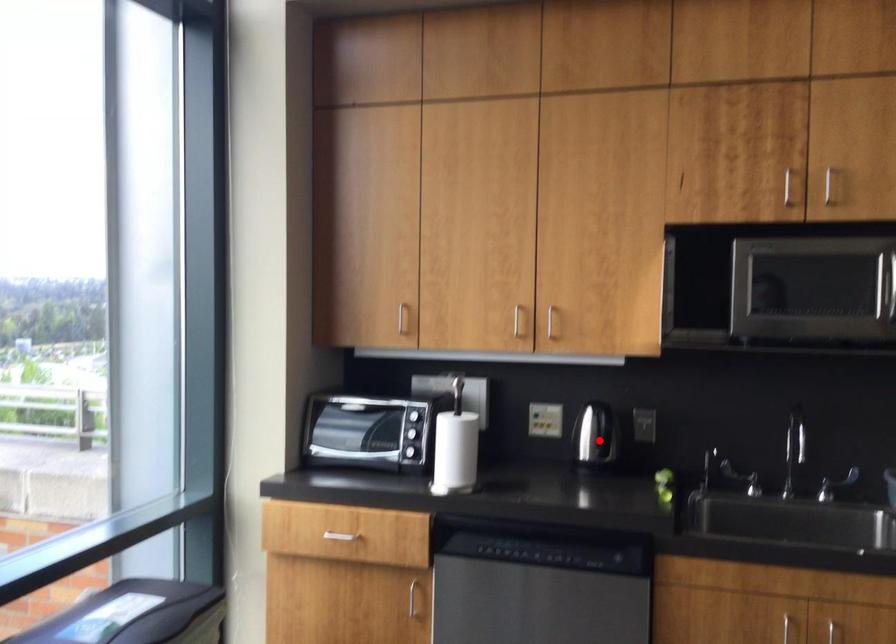
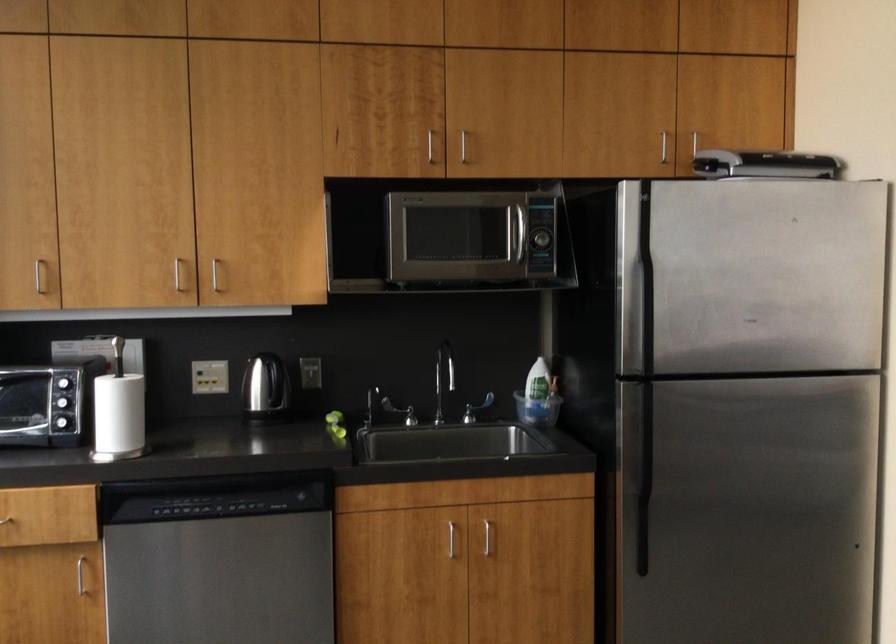
Where in the second image is the point corresponding to the highlighted location from the first image?

(266, 391)